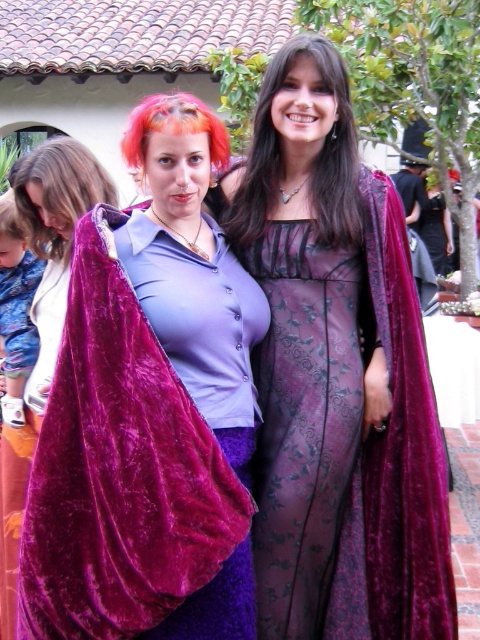
From the picture: Can you confirm if dark brown silky hair at center is positioned above orange dyed hair at center?

Incorrect, dark brown silky hair at center is not positioned above orange dyed hair at center.

At what (x,y) coordinates should I click in order to perform the action: click on dark brown silky hair at center. Please return your answer as a coordinate pair (x, y). Image resolution: width=480 pixels, height=640 pixels. Looking at the image, I should click on (314, 161).

The image size is (480, 640). I want to click on dark brown silky hair at center, so click(314, 161).

Can you confirm if velvet purple dress at center is shorter than dark brown silky hair at center?

In fact, velvet purple dress at center may be taller than dark brown silky hair at center.

Does velvet purple dress at center have a greater height compared to dark brown silky hair at center?

Yes.

Measure the distance between point [338,556] and camera.

A distance of 5.10 meters exists between point [338,556] and camera.

At what (x,y) coordinates should I click in order to perform the action: click on velvet purple dress at center. Please return your answer as a coordinate pair (x, y). Looking at the image, I should click on (336, 376).

Which is above, dark brown silky hair at center or blonde hair at left?

Positioned higher is dark brown silky hair at center.

Is dark brown silky hair at center above blonde hair at left?

Indeed, dark brown silky hair at center is positioned over blonde hair at left.

Who is more distant from viewer, (271, 81) or (104, 173)?

The point (104, 173) is behind.

I want to click on dark brown silky hair at center, so click(314, 161).